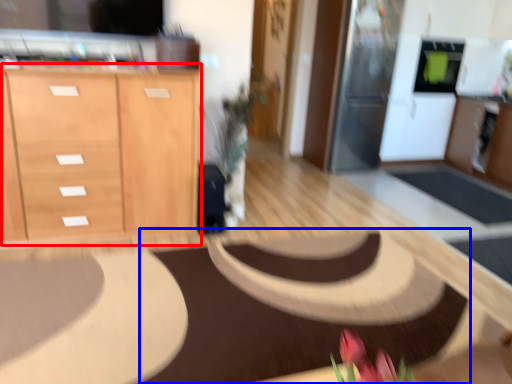
Question: Which object is closer to the camera taking this photo, cabinetry (highlighted by a red box) or mat (highlighted by a blue box)?

Choices:
 (A) cabinetry
 (B) mat

Answer: (B)